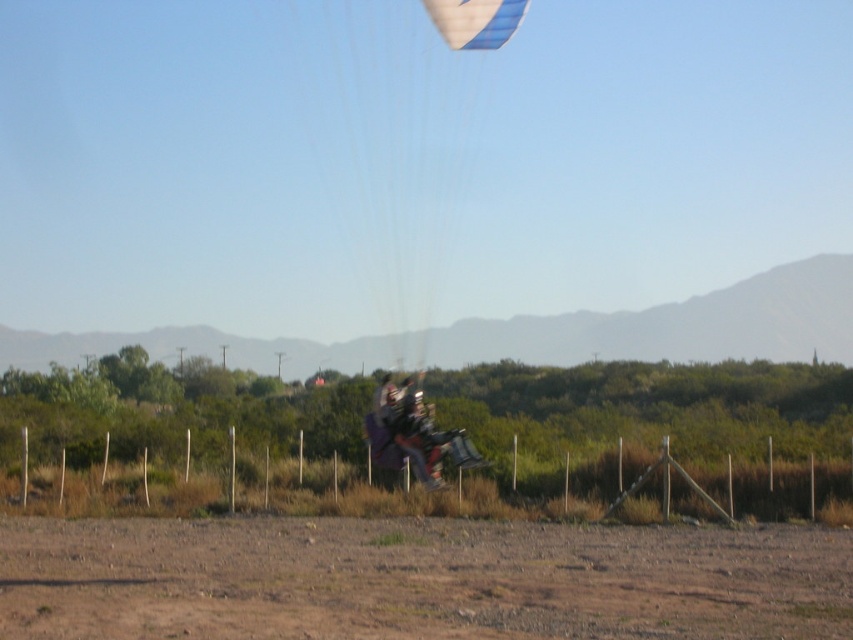
Question: Does dull brown dirt at lower center have a smaller size compared to dark purple fabric parachute at center?

Choices:
 (A) no
 (B) yes

Answer: (A)

Question: Which point is closer to the camera taking this photo?

Choices:
 (A) (418, 442)
 (B) (439, 241)
 (C) (488, 3)
 (D) (715, 584)

Answer: (D)

Question: Among these points, which one is nearest to the camera?

Choices:
 (A) (404, 68)
 (B) (383, 438)
 (C) (184, 572)

Answer: (C)

Question: Can you confirm if blue striped fabric parachute at center is positioned below blue glossy parachute at upper center?

Choices:
 (A) yes
 (B) no

Answer: (A)

Question: Which of these objects is positioned farthest from the blue glossy parachute at upper center?

Choices:
 (A) dark purple fabric parachute at center
 (B) blue striped fabric parachute at center
 (C) dull brown dirt at lower center

Answer: (B)

Question: Is dull brown dirt at lower center to the left of dark purple fabric parachute at center from the viewer's perspective?

Choices:
 (A) yes
 (B) no

Answer: (A)